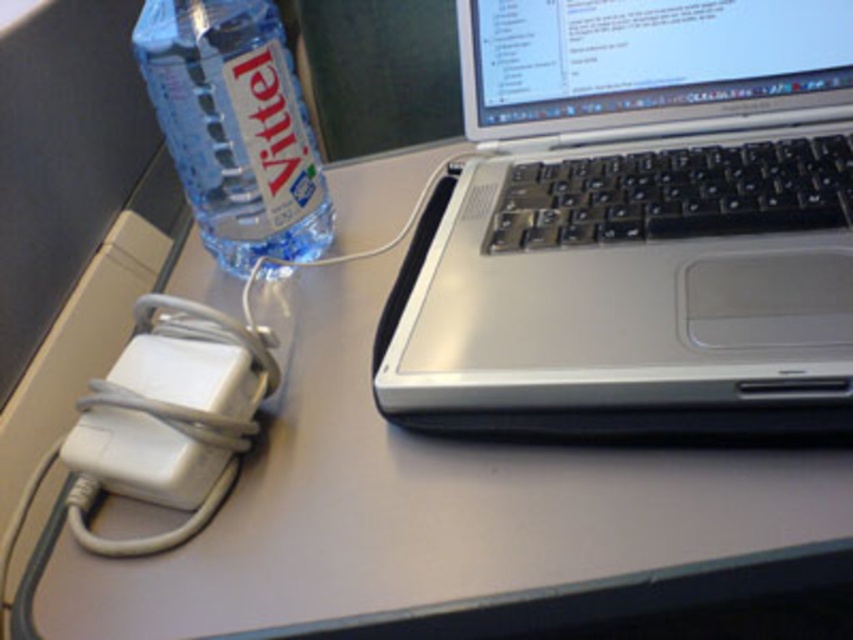
You are organizing your desk and want to place a decorative item between the silver metallic laptop at upper right and the blue plastic bottle at left. Is there enough space for a 10 cm wide item between them?

The silver metallic laptop at upper right is in front of the blue plastic bottle at left, so there is space between them. A 10 cm wide item can fit between the silver metallic laptop at upper right and the blue plastic bottle at left.

You are organizing your desk and want to stack the silver metallic laptop at upper right on top of the blue plastic bottle at left. Is this possible based on their sizes?

The silver metallic laptop at upper right is taller than the blue plastic bottle at left, so stacking the laptop on top of the bottle would not be stable or advisable due to the height difference.